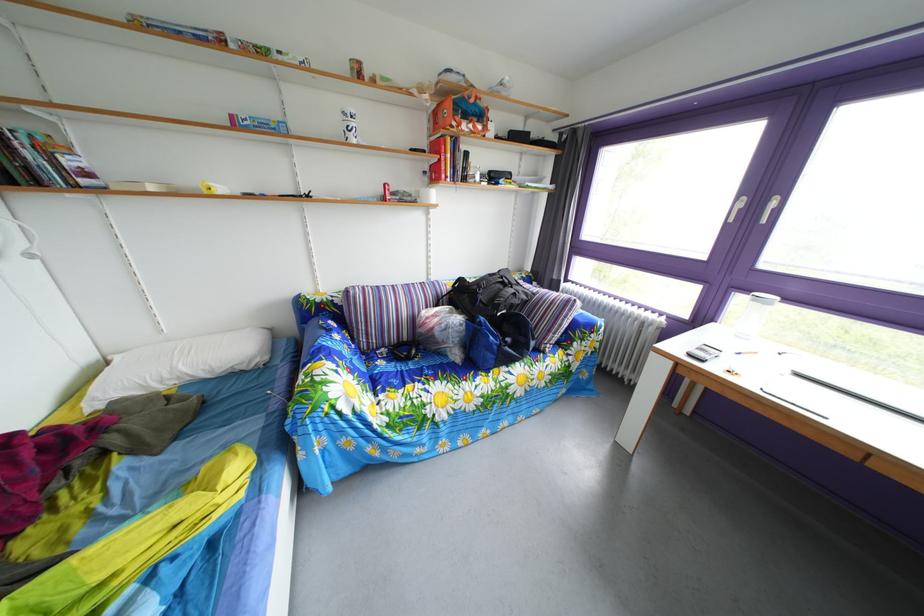
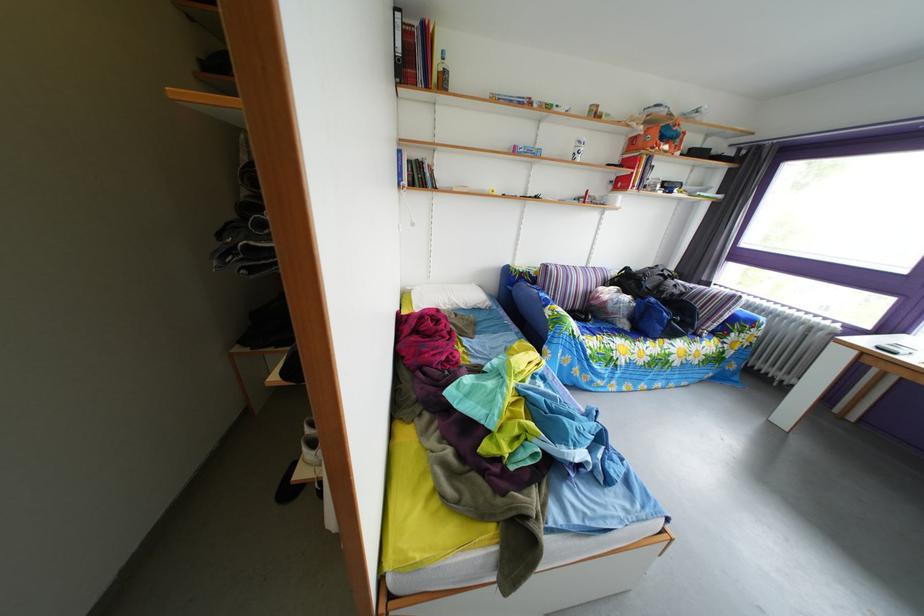
Locate, in the second image, the point that corresponds to (472,302) in the first image.

(638, 289)